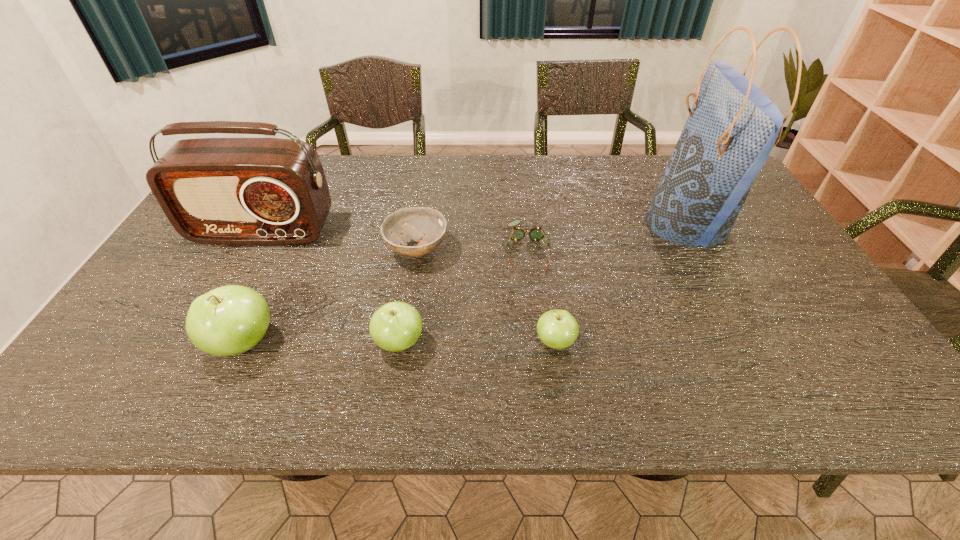
Where is `the leftmost apple`? This screenshot has width=960, height=540. the leftmost apple is located at coordinates (230, 320).

I want to click on the fifth shortest object, so click(x=230, y=320).

Where is `the fourth tallest object`? This screenshot has width=960, height=540. the fourth tallest object is located at coordinates (396, 326).

Image resolution: width=960 pixels, height=540 pixels. What are the coordinates of `the second apple from right to left` in the screenshot? It's located at (396, 326).

The image size is (960, 540). What are the coordinates of `the rightmost apple` in the screenshot? It's located at (557, 329).

Identify the location of shopping bag. (732, 127).

Identify the location of the tallest object. (732, 127).

Find the location of `spectacles`. spectacles is located at coordinates (536, 233).

At what (x,y) coordinates should I click in order to perform the action: click on radio receiver. Please return your answer as a coordinate pair (x, y). The width and height of the screenshot is (960, 540). Looking at the image, I should click on (227, 191).

I want to click on bowl, so click(427, 226).